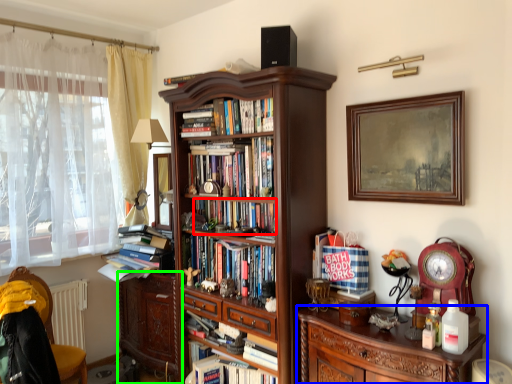
Question: Which is farther away from book (highlighted by a red box)? cabinetry (highlighted by a blue box) or chest of drawers (highlighted by a green box)?

Choices:
 (A) cabinetry
 (B) chest of drawers

Answer: (B)